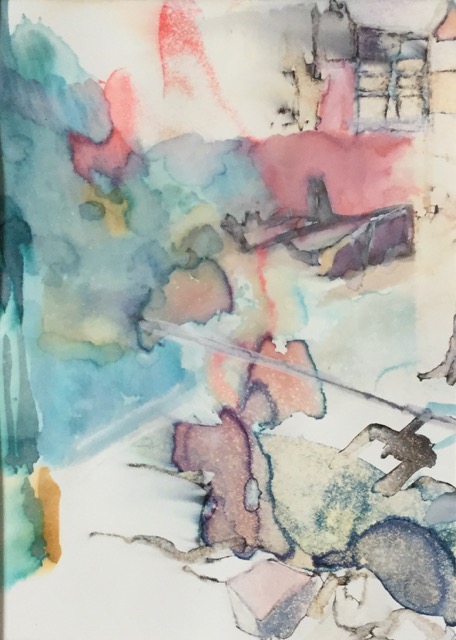
You are a GUI agent. You are given a task and a screenshot of the screen. Output one action in this format:
    pyautogui.click(x=<x>, y=<y>)
    Task: Click on the canvas
    
    Given the screenshot: What is the action you would take?
    pyautogui.click(x=81, y=19)